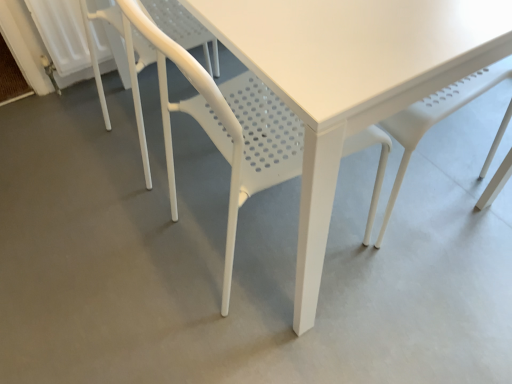
Locate an element on the screen. The height and width of the screenshot is (384, 512). free region under white plastic chair at center, the second chair in the left-to-right sequence (from a real-world perspective) is located at coordinates (258, 238).